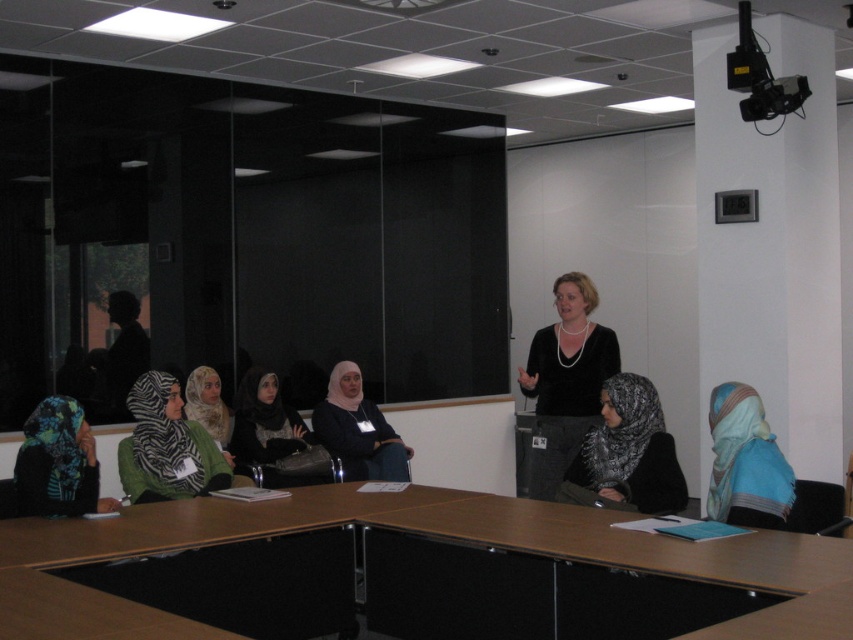
Question: Which point appears farthest from the camera in this image?

Choices:
 (A) (650, 403)
 (B) (669, 605)
 (C) (740, 460)

Answer: (A)

Question: Is matte black hijab at center to the right of light blue scarf at center from the viewer's perspective?

Choices:
 (A) no
 (B) yes

Answer: (A)

Question: Is black textured hijab at lower right to the right of blue silk hijab at lower right from the viewer's perspective?

Choices:
 (A) no
 (B) yes

Answer: (A)

Question: Does black matte/black sweater at center have a greater width compared to zebra print scarf at lower left?

Choices:
 (A) yes
 (B) no

Answer: (B)

Question: Estimate the real-world distances between objects in this image. Which object is closer to the black textured hijab at lower right?

Choices:
 (A) black matte/black sweater at center
 (B) light beige scarf at center
 (C) brown wood table at center

Answer: (C)

Question: Among these points, which one is nearest to the camera?

Choices:
 (A) (583, 284)
 (B) (741, 385)

Answer: (B)